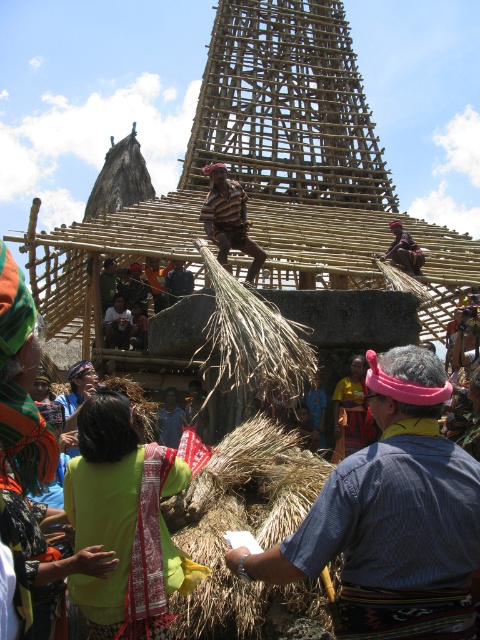
Can you confirm if strawmaterial/texturehay at center is positioned above dark blue shirt at center?

Incorrect, strawmaterial/texturehay at center is not positioned above dark blue shirt at center.

Consider the image. Can you confirm if strawmaterial/texturehay at center is positioned to the right of dark blue shirt at center?

Indeed, strawmaterial/texturehay at center is positioned on the right side of dark blue shirt at center.

What do you see at coordinates (239, 522) in the screenshot? The image size is (480, 640). I see `strawmaterial/texturehay at center` at bounding box center [239, 522].

The width and height of the screenshot is (480, 640). I want to click on strawmaterial/texturehay at center, so click(239, 522).

Which is more to the left, striped fabric man at center or dark blue shirt at center?

Positioned to the left is dark blue shirt at center.

Between point (217, 205) and point (173, 282), which one is positioned behind?

Point (173, 282)

What do you see at coordinates (228, 218) in the screenshot?
I see `striped fabric man at center` at bounding box center [228, 218].

Identify the location of striped fabric man at center. The height and width of the screenshot is (640, 480). (228, 218).

Consider the image. Can you confirm if strawmaterial/texturehay at center is positioned below matte black shirt at center?

Yes.

Between strawmaterial/texturehay at center and matte black shirt at center, which one appears on the left side from the viewer's perspective?

Positioned to the left is matte black shirt at center.

Between point (205, 612) and point (118, 307), which one is positioned behind?

The point (118, 307) is more distant.

You are a GUI agent. You are given a task and a screenshot of the screen. Output one action in this format:
    pyautogui.click(x=<x>, y=<y>)
    Task: Click on the strawmaterial/texturehay at center
    The image size is (480, 640).
    Given the screenshot: What is the action you would take?
    pyautogui.click(x=239, y=522)